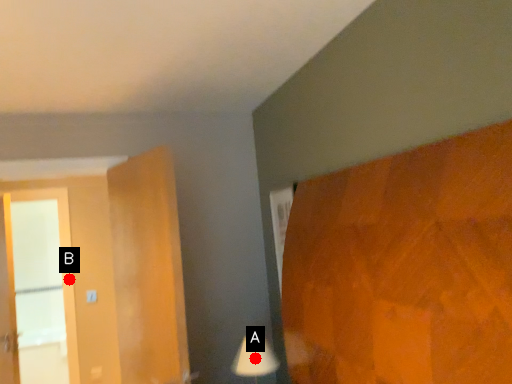
Question: Two points are circled on the image, labeled by A and B beside each circle. Which point is further to the camera?

Choices:
 (A) A is further
 (B) B is further

Answer: (B)